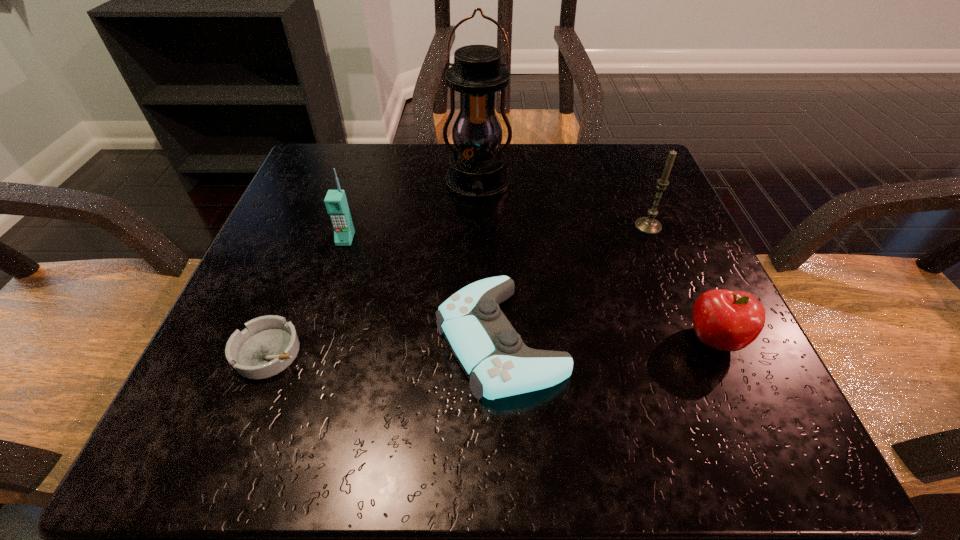
Where is `unoccupied area between the ashtray and the candle`? unoccupied area between the ashtray and the candle is located at coordinates pyautogui.click(x=459, y=289).

I want to click on free space between the apple and the lantern, so click(x=596, y=262).

Locate an element on the screen. This screenshot has height=540, width=960. unoccupied area between the tallest object and the cellular telephone is located at coordinates (412, 212).

Find the location of a particular element. The image size is (960, 540). free space between the ashtray and the candle is located at coordinates (459, 289).

Where is `vacant space that is in between the cellular telephone and the ashtray`? vacant space that is in between the cellular telephone and the ashtray is located at coordinates (307, 295).

Where is `free space between the candle and the shortest object`? Image resolution: width=960 pixels, height=540 pixels. free space between the candle and the shortest object is located at coordinates (459, 289).

Locate an element on the screen. This screenshot has width=960, height=540. object that can be found as the third closest to the candle is located at coordinates (477, 169).

Find the location of `object that is the fifth closest to the lantern`. object that is the fifth closest to the lantern is located at coordinates (726, 320).

In order to click on vacant space that satisfies the following two spatial constraints: 1. above the fourth tallest object, indicating its light source; 2. on the right side of the farthest object in this screenshot , I will do `click(477, 340)`.

Where is `free location that satisfies the following two spatial constraints: 1. above the fifth tallest object, indicating its light source; 2. on the left side of the tallest object`? The width and height of the screenshot is (960, 540). free location that satisfies the following two spatial constraints: 1. above the fifth tallest object, indicating its light source; 2. on the left side of the tallest object is located at coordinates [x=477, y=339].